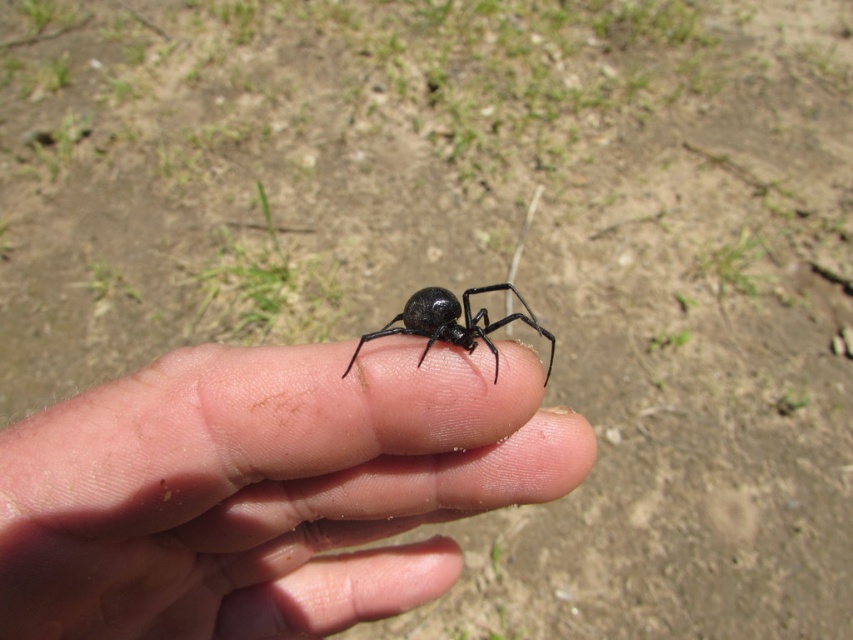
Question: Observing the image, what is the correct spatial positioning of smooth skin at center in reference to black matte spider at center?

Choices:
 (A) right
 (B) left

Answer: (B)

Question: Can you confirm if smooth skin at center is positioned below black matte spider at center?

Choices:
 (A) no
 (B) yes

Answer: (B)

Question: Which point is farther from the camera taking this photo?

Choices:
 (A) (370, 602)
 (B) (550, 333)

Answer: (B)

Question: Which of the following is the farthest from the observer?

Choices:
 (A) black matte spider at center
 (B) smooth skin at center

Answer: (A)

Question: Does smooth skin at center appear on the right side of black matte spider at center?

Choices:
 (A) no
 (B) yes

Answer: (A)